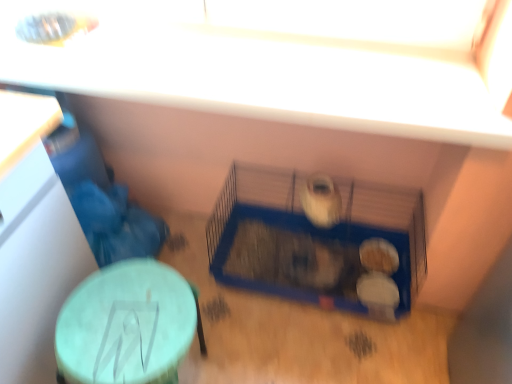
Question: Is green matte table at lower left in front of blue wire bird cage at center?

Choices:
 (A) no
 (B) yes

Answer: (B)

Question: Considering the relative sizes of green matte table at lower left and blue wire bird cage at center in the image provided, is green matte table at lower left wider than blue wire bird cage at center?

Choices:
 (A) yes
 (B) no

Answer: (B)

Question: Considering the relative positions of green matte table at lower left and blue wire bird cage at center in the image provided, is green matte table at lower left to the right of blue wire bird cage at center from the viewer's perspective?

Choices:
 (A) no
 (B) yes

Answer: (A)

Question: Is green matte table at lower left turned away from blue wire bird cage at center?

Choices:
 (A) no
 (B) yes

Answer: (A)

Question: Is green matte table at lower left touching blue wire bird cage at center?

Choices:
 (A) no
 (B) yes

Answer: (A)

Question: Are green matte table at lower left and blue wire bird cage at center far apart?

Choices:
 (A) no
 (B) yes

Answer: (A)

Question: From the image's perspective, is blue wire bird cage at center on top of blue plastic cage at center?

Choices:
 (A) no
 (B) yes

Answer: (B)

Question: Is blue wire bird cage at center far away from blue plastic cage at center?

Choices:
 (A) no
 (B) yes

Answer: (A)

Question: Can you confirm if blue wire bird cage at center is smaller than blue plastic cage at center?

Choices:
 (A) yes
 (B) no

Answer: (B)

Question: Considering the relative positions of blue wire bird cage at center and blue plastic cage at center in the image provided, is blue wire bird cage at center to the right of blue plastic cage at center from the viewer's perspective?

Choices:
 (A) no
 (B) yes

Answer: (B)

Question: Is blue wire bird cage at center shorter than blue plastic cage at center?

Choices:
 (A) yes
 (B) no

Answer: (B)

Question: Is blue wire bird cage at center bigger than blue plastic cage at center?

Choices:
 (A) no
 (B) yes

Answer: (B)

Question: Can you confirm if blue plastic cage at center is taller than blue wire bird cage at center?

Choices:
 (A) yes
 (B) no

Answer: (B)